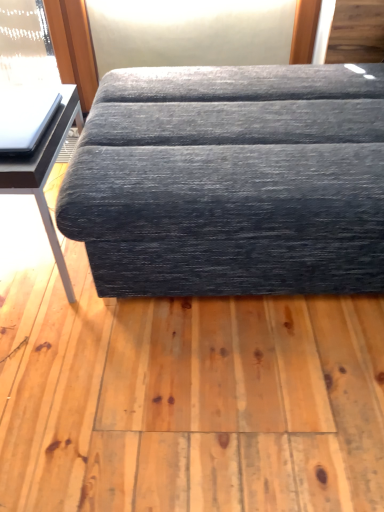
Question: Is matte black table at left bigger or smaller than textured gray fabric couch at center?

Choices:
 (A) big
 (B) small

Answer: (B)

Question: Is matte black table at left to the left or to the right of textured gray fabric couch at center in the image?

Choices:
 (A) left
 (B) right

Answer: (A)

Question: In terms of width, does matte black table at left look wider or thinner when compared to textured gray fabric couch at center?

Choices:
 (A) wide
 (B) thin

Answer: (B)

Question: Is textured gray fabric couch at center situated inside matte black table at left or outside?

Choices:
 (A) outside
 (B) inside

Answer: (A)

Question: Is textured gray fabric couch at center bigger or smaller than matte black table at left?

Choices:
 (A) big
 (B) small

Answer: (A)

Question: From a real-world perspective, relative to matte black table at left, is textured gray fabric couch at center vertically above or below?

Choices:
 (A) below
 (B) above

Answer: (B)

Question: In the image, is textured gray fabric couch at center positioned in front of or behind matte black table at left?

Choices:
 (A) behind
 (B) front

Answer: (B)